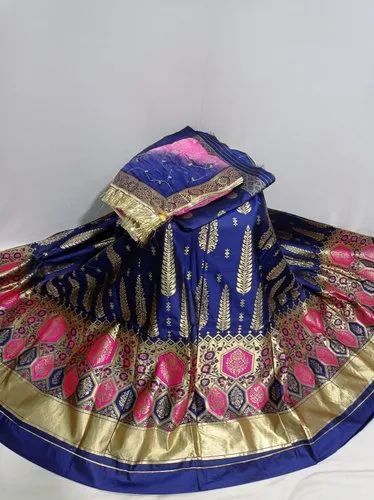
Identify the location of floor. Image resolution: width=374 pixels, height=500 pixels. (339, 470).